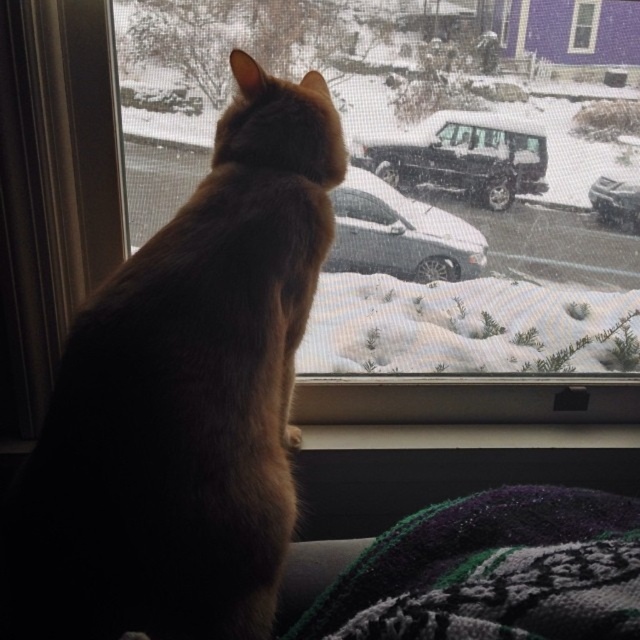
Question: Which object is positioned closest to the transparent glass window at center?

Choices:
 (A) clear glass window at upper center
 (B) sleek silver sedan at center
 (C) black matte truck at center

Answer: (C)

Question: Does transparent glass window at center have a larger size compared to black matte truck at center?

Choices:
 (A) no
 (B) yes

Answer: (B)

Question: Is black matte truck at center thinner than sleek silver sedan at center?

Choices:
 (A) yes
 (B) no

Answer: (B)

Question: Which of these objects is positioned closest to the metallic silver sedan at right?

Choices:
 (A) sleek silver sedan at center
 (B) black matte truck at center

Answer: (B)

Question: In this image, where is knitted woolen blanket at lower right located relative to black matte truck at center?

Choices:
 (A) above
 (B) below

Answer: (B)

Question: Among these objects, which one is nearest to the camera?

Choices:
 (A) brown furry cat at center
 (B) metallic silver sedan at right
 (C) transparent glass window at center
 (D) clear glass window at upper center

Answer: (A)